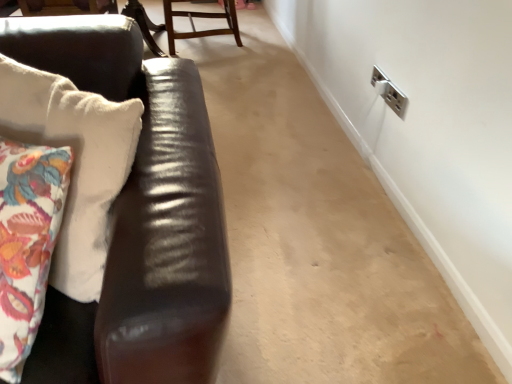
This screenshot has height=384, width=512. Identify the location of shiny brown leather couch at left. (139, 218).

This screenshot has width=512, height=384. What do you see at coordinates (139, 218) in the screenshot?
I see `shiny brown leather couch at left` at bounding box center [139, 218].

Where is `wooden chair at upper center`? wooden chair at upper center is located at coordinates (200, 17).

This screenshot has width=512, height=384. What do you see at coordinates (200, 17) in the screenshot?
I see `wooden chair at upper center` at bounding box center [200, 17].

Identify the location of shiny brown leather couch at left. This screenshot has height=384, width=512. (139, 218).

Between wooden chair at upper center and shiny brown leather couch at left, which one appears on the left side from the viewer's perspective?

From the viewer's perspective, shiny brown leather couch at left appears more on the left side.

Does wooden chair at upper center come in front of shiny brown leather couch at left?

No, wooden chair at upper center is further to the viewer.

Is point (167, 33) closer or farther from the camera than point (5, 31)?

Point (167, 33) is farther from the camera than point (5, 31).

From the image's perspective, which is above, wooden chair at upper center or shiny brown leather couch at left?

wooden chair at upper center appears higher in the image.

From a real-world perspective, is wooden chair at upper center physically below shiny brown leather couch at left?

Yes, from a real-world perspective, wooden chair at upper center is below shiny brown leather couch at left.

In terms of width, does wooden chair at upper center look wider or thinner when compared to shiny brown leather couch at left?

In the image, wooden chair at upper center appears to be more narrow than shiny brown leather couch at left.

Does wooden chair at upper center have a greater height compared to shiny brown leather couch at left?

Incorrect, the height of wooden chair at upper center is not larger of that of shiny brown leather couch at left.

Can you confirm if wooden chair at upper center is bigger than shiny brown leather couch at left?

No, wooden chair at upper center is not bigger than shiny brown leather couch at left.

Is wooden chair at upper center completely or partially outside of shiny brown leather couch at left?

Indeed, wooden chair at upper center is completely outside shiny brown leather couch at left.

Is there a large distance between wooden chair at upper center and shiny brown leather couch at left?

Indeed, wooden chair at upper center is not near shiny brown leather couch at left.

Is wooden chair at upper center oriented towards shiny brown leather couch at left?

No, wooden chair at upper center does not turn towards shiny brown leather couch at left.

What's the angular difference between wooden chair at upper center and shiny brown leather couch at left's facing directions?

The angular difference between wooden chair at upper center and shiny brown leather couch at left is 87.8 degrees.

How far apart are wooden chair at upper center and shiny brown leather couch at left?

They are 6.30 feet apart.

This screenshot has width=512, height=384. I want to click on studio couch below the wooden chair at upper center (from the image's perspective), so click(139, 218).

Which object is positioned more to the right, shiny brown leather couch at left or wooden chair at upper center?

Positioned to the right is wooden chair at upper center.

Is shiny brown leather couch at left further to camera compared to wooden chair at upper center?

No, it is in front of wooden chair at upper center.

Which is closer, (184,377) or (181,1)?

Point (184,377) is positioned closer to the camera compared to point (181,1).

From the image's perspective, is shiny brown leather couch at left located above or below wooden chair at upper center?

Based on their image positions, shiny brown leather couch at left is located beneath wooden chair at upper center.

From a real-world perspective, who is located higher, shiny brown leather couch at left or wooden chair at upper center?

shiny brown leather couch at left is physically above.

Which object is thinner, shiny brown leather couch at left or wooden chair at upper center?

wooden chair at upper center is thinner.

Considering the sizes of objects shiny brown leather couch at left and wooden chair at upper center in the image provided, who is taller, shiny brown leather couch at left or wooden chair at upper center?

With more height is shiny brown leather couch at left.

Considering the relative sizes of shiny brown leather couch at left and wooden chair at upper center in the image provided, is shiny brown leather couch at left bigger than wooden chair at upper center?

Yes, shiny brown leather couch at left is bigger than wooden chair at upper center.

Consider the image. Is shiny brown leather couch at left surrounding wooden chair at upper center?

No.

Based on the photo, is shiny brown leather couch at left directly adjacent to wooden chair at upper center?

No, shiny brown leather couch at left is not beside wooden chair at upper center.

Is shiny brown leather couch at left facing away from wooden chair at upper center?

Yes, wooden chair at upper center is at the back of shiny brown leather couch at left.

Measure the distance between shiny brown leather couch at left and wooden chair at upper center.

shiny brown leather couch at left is 6.30 feet from wooden chair at upper center.

You are a GUI agent. You are given a task and a screenshot of the screen. Output one action in this format:
    pyautogui.click(x=<x>, y=<y>)
    Task: Click on the chair to the right of shiny brown leather couch at left
    This screenshot has height=384, width=512.
    Given the screenshot: What is the action you would take?
    pyautogui.click(x=200, y=17)

Where is `studio couch positioned vertically above the wooden chair at upper center (from a real-world perspective)`? Image resolution: width=512 pixels, height=384 pixels. studio couch positioned vertically above the wooden chair at upper center (from a real-world perspective) is located at coordinates (139, 218).

Locate an element on the screen. Image resolution: width=512 pixels, height=384 pixels. chair behind the shiny brown leather couch at left is located at coordinates (200, 17).